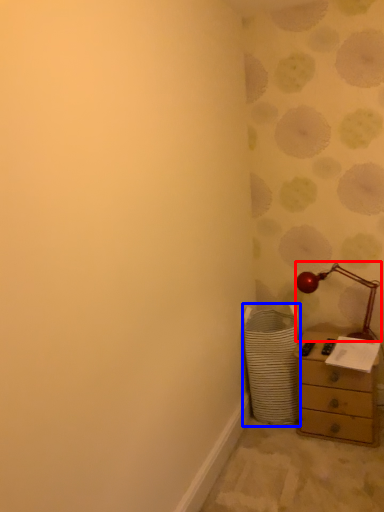
Question: Which object is further to the camera taking this photo, table lamp (highlighted by a red box) or laundry basket (highlighted by a blue box)?

Choices:
 (A) table lamp
 (B) laundry basket

Answer: (A)